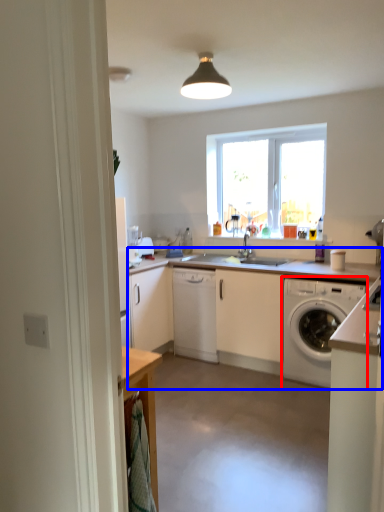
Question: Which point is closer to the camera, washing machine (highlighted by a red box) or countertop (highlighted by a blue box)?

Choices:
 (A) washing machine
 (B) countertop

Answer: (B)